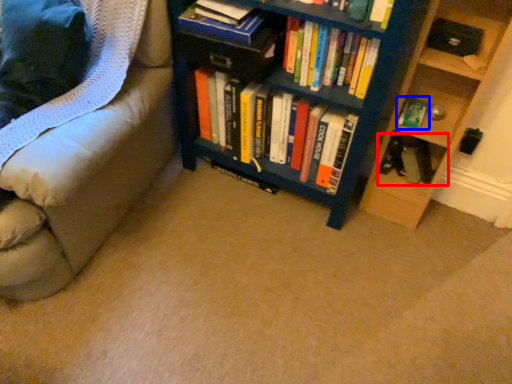
Question: Which object appears closest to the camera in this image, book (highlighted by a red box) or book (highlighted by a blue box)?

Choices:
 (A) book
 (B) book

Answer: (B)